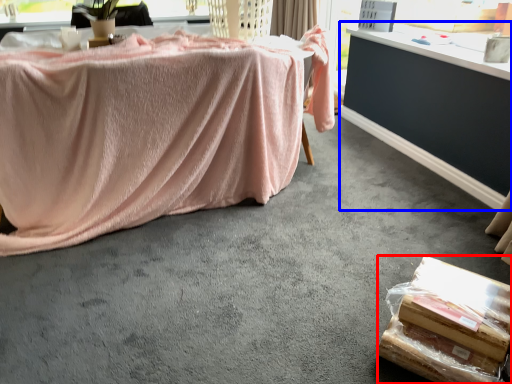
Question: Which point is further to the camera, food (highlighted by a red box) or table (highlighted by a blue box)?

Choices:
 (A) food
 (B) table

Answer: (B)